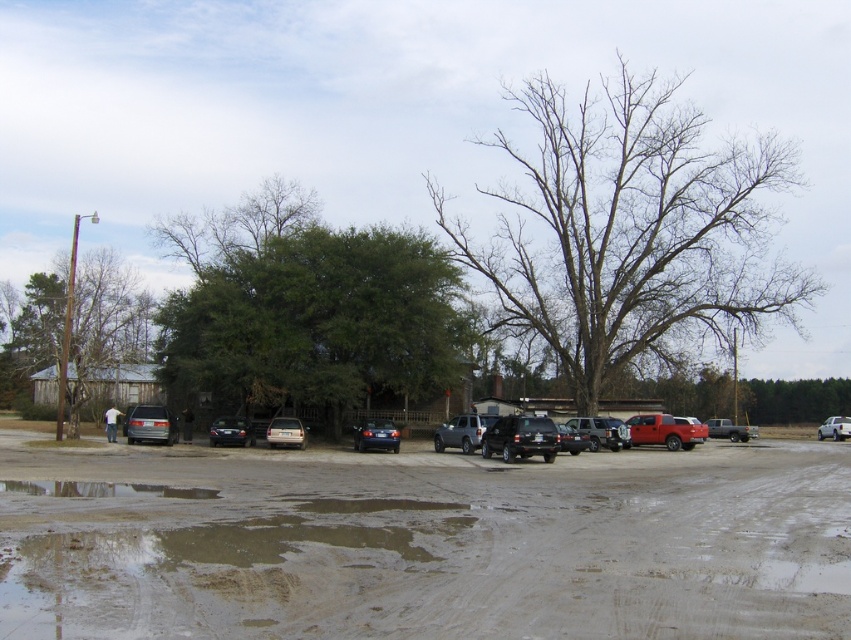
You are standing at the point marked as point (x=95, y=625) in the parking lot. If you want to take a photo of the entire parking lot, would you need to move closer or farther away from your current position?

Since the point marked as point (x=95, y=625) is 7.56 meters away from the camera, you would need to move closer to capture the entire parking lot in one frame.

You are a delivery driver who needs to park your truck in this parking lot. You see the matte black truck at center and the metallic silver van at right. Which vehicle should you avoid parking behind to stay closer to the entrance?

You should avoid parking behind the metallic silver van at right because the matte black truck at center is closer to the viewer, meaning it is nearer to the entrance. Parking behind the metallic silver van at right would place you further away from the entrance.

You are a delivery driver who needs to park your truck between the satin blue sedan at center and the satin black sedan at center. Which sedan should you park next to if you want to be closer to the shed on the left?

The satin black sedan at center is closer to the shed on the left, so you should park next to the satin black sedan at center.